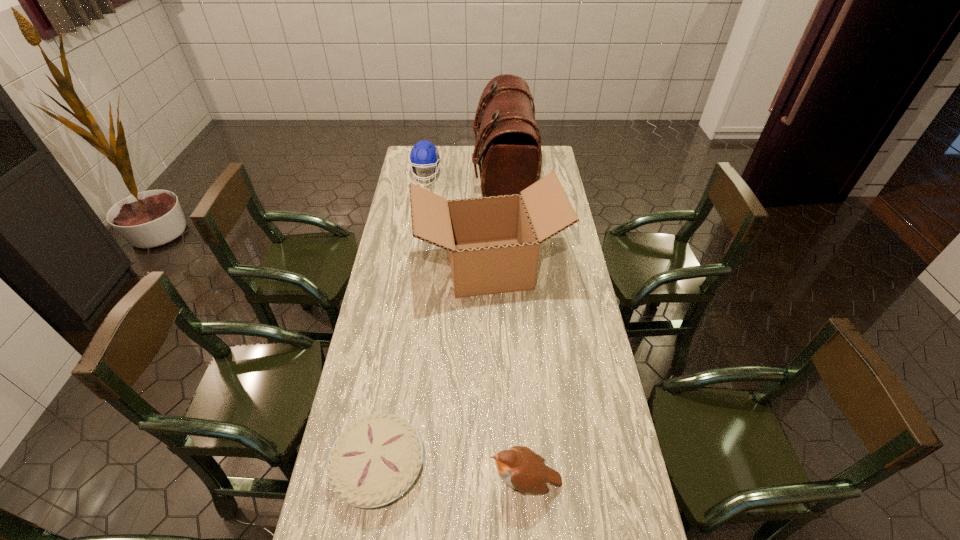
At what (x,y) coordinates should I click in order to perform the action: click on blank region between the tallest object and the shortest object. Please return your answer as a coordinate pair (x, y). Looking at the image, I should click on (441, 321).

This screenshot has width=960, height=540. What are the coordinates of `free space between the football helmet and the satchel` in the screenshot? It's located at (465, 176).

In order to click on free space between the tallest object and the bird in this screenshot , I will do `click(515, 329)`.

Locate which object ranks in proximity to the second tallest object. Please provide its 2D coordinates. Your answer should be formatted as a tuple, i.e. [(x, y)], where the tuple contains the x and y coordinates of a point satisfying the conditions above.

[(507, 148)]

At what (x,y) coordinates should I click in order to perform the action: click on object that ranks as the closest to the bird. Please return your answer as a coordinate pair (x, y). The height and width of the screenshot is (540, 960). Looking at the image, I should click on (375, 460).